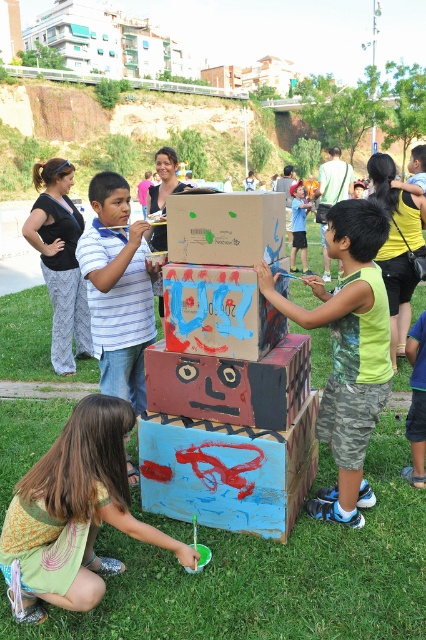
Question: From the image, what is the correct spatial relationship of green fabric dress at lower left in relation to black fabric top at upper left?

Choices:
 (A) above
 (B) below

Answer: (B)

Question: Which object is farther from the camera taking this photo?

Choices:
 (A) green fabric dress at lower left
 (B) matte red cardboard box at center
 (C) black fabric top at upper left
 (D) striped cotton shirt at center

Answer: (C)

Question: Which is farther from the black fabric top at upper left?

Choices:
 (A) green fabric dress at lower left
 (B) cardboard box at center

Answer: (A)

Question: Observing the image, what is the correct spatial positioning of green grass at lower center in reference to matte red cardboard box at center?

Choices:
 (A) right
 (B) left

Answer: (A)

Question: Which object is closer to the camera taking this photo?

Choices:
 (A) black fabric top at upper left
 (B) striped cotton shirt at center

Answer: (B)

Question: Does matte red cardboard box at center lie in front of black fabric top at upper left?

Choices:
 (A) yes
 (B) no

Answer: (A)